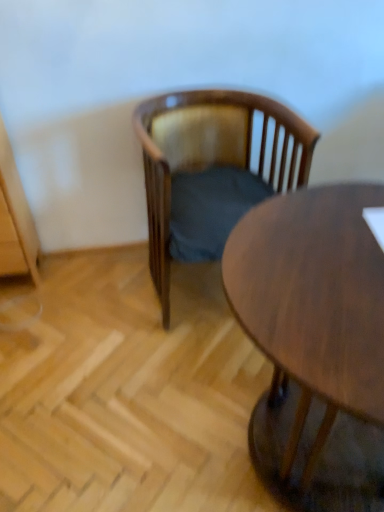
What do you see at coordinates (315, 343) in the screenshot?
I see `wooden round table at center` at bounding box center [315, 343].

Measure the distance between point [307,301] and camera.

The depth of point [307,301] is 32.60 inches.

In the scene shown: In order to face wooden round table at center, should I rotate leftwards or rightwards?

Turn right approximately 20.384 degrees to face it.

Find the location of `wooden round table at center`. wooden round table at center is located at coordinates (315, 343).

I want to click on wooden chair with cushion at center, so click(x=211, y=170).

This screenshot has width=384, height=512. What do you see at coordinates (211, 170) in the screenshot?
I see `wooden chair with cushion at center` at bounding box center [211, 170].

Measure the distance between point (154, 216) and camera.

Point (154, 216) and camera are 4.86 feet apart from each other.

This screenshot has width=384, height=512. In order to click on wooden round table at center in this screenshot , I will do `click(315, 343)`.

Can you confirm if wooden chair with cushion at center is positioned to the left of wooden round table at center?

Yes, wooden chair with cushion at center is to the left of wooden round table at center.

Based on the photo, is wooden chair with cushion at center positioned before wooden round table at center?

No, it is not.

Is point (195, 158) positioned before point (290, 305)?

No, (195, 158) is further to viewer.

From the image's perspective, who appears lower, wooden chair with cushion at center or wooden round table at center?

From the image's view, wooden round table at center is below.

From a real-world perspective, which is physically below, wooden chair with cushion at center or wooden round table at center?

wooden round table at center is physically lower.

Between wooden chair with cushion at center and wooden round table at center, which one has smaller width?

With smaller width is wooden chair with cushion at center.

Which of these two, wooden chair with cushion at center or wooden round table at center, stands shorter?

wooden chair with cushion at center is shorter.

Considering the sizes of wooden chair with cushion at center and wooden round table at center in the image, is wooden chair with cushion at center bigger or smaller than wooden round table at center?

wooden chair with cushion at center is smaller than wooden round table at center.

Would you say wooden chair with cushion at center is inside or outside wooden round table at center?

wooden chair with cushion at center is outside wooden round table at center.

Is wooden chair with cushion at center touching wooden round table at center?

No, wooden chair with cushion at center is not touching wooden round table at center.

Is wooden chair with cushion at center turned away from wooden round table at center?

No, wooden chair with cushion at center's orientation is not away from wooden round table at center.

The height and width of the screenshot is (512, 384). In order to click on coffee table located in front of the wooden chair with cushion at center in this screenshot , I will do `click(315, 343)`.

Which object is positioned more to the left, wooden round table at center or wooden chair with cushion at center?

Positioned to the left is wooden chair with cushion at center.

In the image, is wooden round table at center positioned in front of or behind wooden chair with cushion at center?

Clearly, wooden round table at center is in front of wooden chair with cushion at center.

Is point (264, 280) positioned behind point (147, 148)?

No, (264, 280) is in front of (147, 148).

From the image's perspective, is wooden round table at center beneath wooden chair with cushion at center?

Yes, from the image's perspective, wooden round table at center is below wooden chair with cushion at center.

Looking at this image, from a real-world perspective, relative to wooden chair with cushion at center, is wooden round table at center vertically above or below?

In terms of real-world spatial position, wooden round table at center is below wooden chair with cushion at center.

Considering the sizes of wooden round table at center and wooden chair with cushion at center in the image, is wooden round table at center wider or thinner than wooden chair with cushion at center?

wooden round table at center is wider than wooden chair with cushion at center.

Which of these two, wooden round table at center or wooden chair with cushion at center, stands taller?

wooden round table at center.

Based on their sizes in the image, would you say wooden round table at center is bigger or smaller than wooden chair with cushion at center?

In the image, wooden round table at center appears to be larger than wooden chair with cushion at center.

Could wooden chair with cushion at center be considered to be inside wooden round table at center?

No, wooden round table at center does not contain wooden chair with cushion at center.

Is wooden round table at center directly adjacent to wooden chair with cushion at center?

wooden round table at center is not next to wooden chair with cushion at center, and they're not touching.

Could you tell me if wooden round table at center is turned towards wooden chair with cushion at center?

No, wooden round table at center is not facing towards wooden chair with cushion at center.

How many degrees apart are the facing directions of wooden round table at center and wooden chair with cushion at center?

The facing directions of wooden round table at center and wooden chair with cushion at center are 5.59 degrees apart.

Locate an element on the screen. chair above the wooden round table at center (from the image's perspective) is located at coordinates (211, 170).

The width and height of the screenshot is (384, 512). Find the location of `chair located behind the wooden round table at center`. chair located behind the wooden round table at center is located at coordinates (211, 170).

Locate an element on the screen. The image size is (384, 512). coffee table in front of the wooden chair with cushion at center is located at coordinates (315, 343).